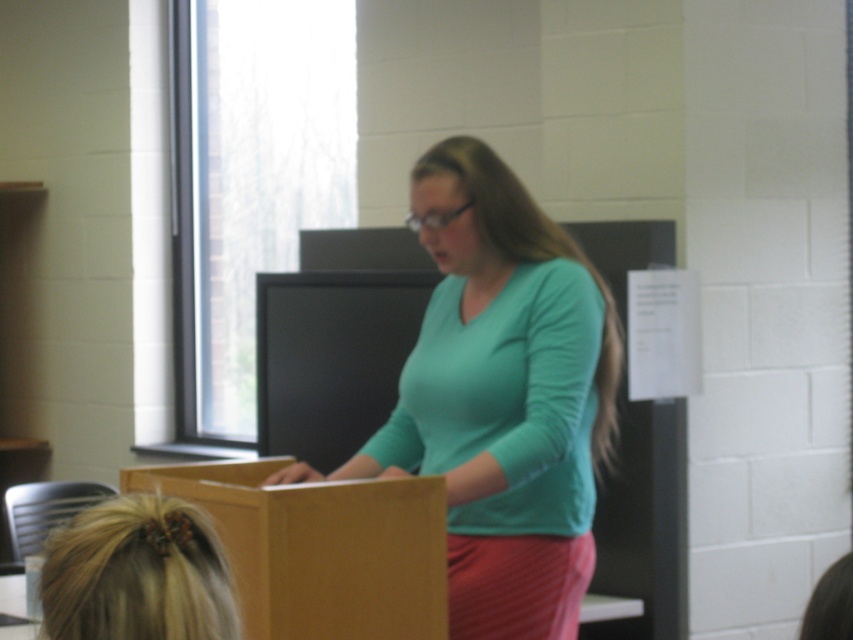
You are an attendee at the event and want to place a small note on the podium. The podium has limited space. Which object, the matte brown cardboard box at center or the blonde hair at lower left, is closer to the edge of the podium where you can place your note?

The blonde hair at lower left is located above the matte brown cardboard box at center, so placing the note near the edge below the blonde hair at lower left would be possible since it is closer to the edge of the podium.

You are in a classroom and want to walk from the podium to the door located at point [219,547]. There is an obstacle at point [572,317]. Can you go around the obstacle and reach the door?

Point [572,317] is further to the viewer than point [219,547], so the obstacle is closer to you. You can go around it and reach the door at point [219,547].

You are a speaker standing at the wooden podium indoors. You need to place a matte brown cardboard box at center on the podium. Can you determine the exact coordinates where you should place it?

The exact coordinates for placing the matte brown cardboard box at center are at point [321,548].